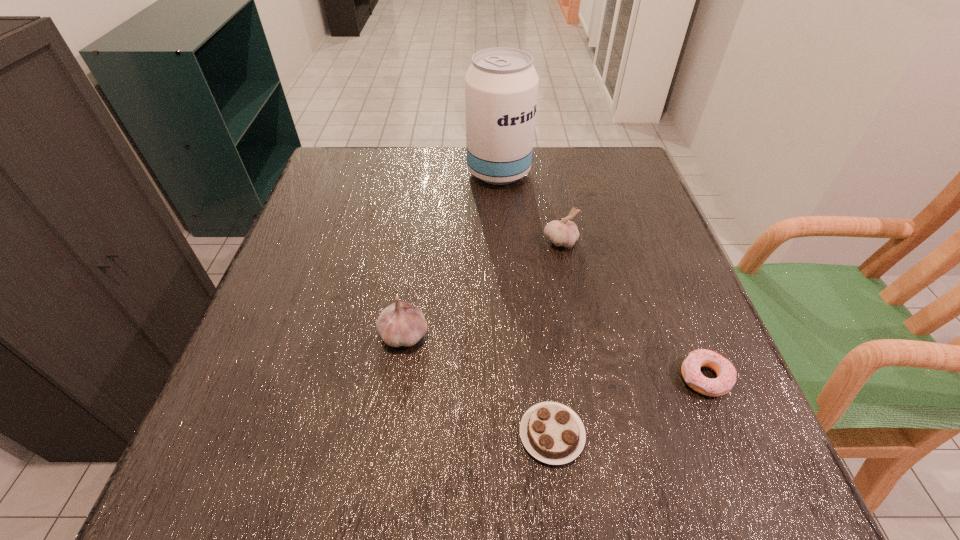
You are a GUI agent. You are given a task and a screenshot of the screen. Output one action in this format:
    pyautogui.click(x=<x>, y=<y>)
    Task: Click on the free space between the farthest object and the third shortest object
    
    Given the screenshot: What is the action you would take?
    pyautogui.click(x=529, y=207)

Identify the location of free area in between the rightmost object and the nearest object. (629, 406).

Where is `object identified as the fourth closest to the doughnut`? This screenshot has height=540, width=960. object identified as the fourth closest to the doughnut is located at coordinates (501, 85).

Identify the location of the second closest object to the nearer garlic. This screenshot has height=540, width=960. (562, 232).

Where is `vacant point that satisfies the following two spatial constraints: 1. on the front side of the farthest object; 2. on the right side of the shorter garlic`? vacant point that satisfies the following two spatial constraints: 1. on the front side of the farthest object; 2. on the right side of the shorter garlic is located at coordinates (502, 241).